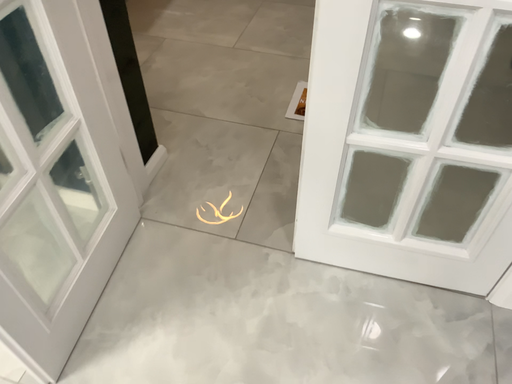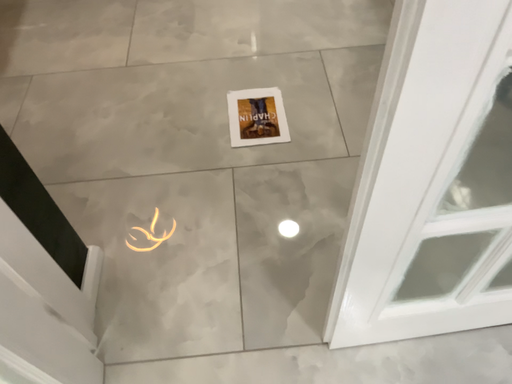
Question: How did the camera likely rotate when shooting the video?

Choices:
 (A) rotated right
 (B) rotated left

Answer: (A)